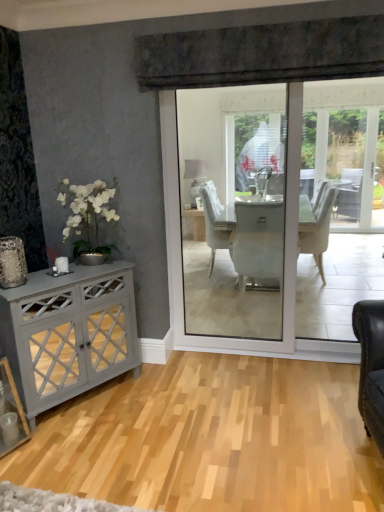
Question: In the image, is matte gray cabinet at left on the left side or the right side of natural wood floor at center?

Choices:
 (A) left
 (B) right

Answer: (A)

Question: Relative to natural wood floor at center, is matte gray cabinet at left in front or behind?

Choices:
 (A) behind
 (B) front

Answer: (A)

Question: Choose the correct answer: Is matte gray cabinet at left inside natural wood floor at center or outside it?

Choices:
 (A) outside
 (B) inside

Answer: (A)

Question: Is natural wood floor at center wider or thinner than matte gray cabinet at left?

Choices:
 (A) thin
 (B) wide

Answer: (B)

Question: Is natural wood floor at center in front of or behind matte gray cabinet at left in the image?

Choices:
 (A) front
 (B) behind

Answer: (A)

Question: Considering the positions of point (150, 472) and point (26, 291), is point (150, 472) closer or farther from the camera than point (26, 291)?

Choices:
 (A) farther
 (B) closer

Answer: (B)

Question: In the image, is natural wood floor at center on the left side or the right side of matte gray cabinet at left?

Choices:
 (A) left
 (B) right

Answer: (B)